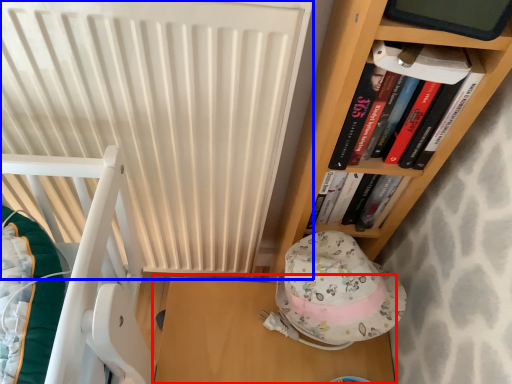
Question: Which of the following is the farthest to the observer, table (highlighted by a red box) or radiator (highlighted by a blue box)?

Choices:
 (A) table
 (B) radiator

Answer: (A)